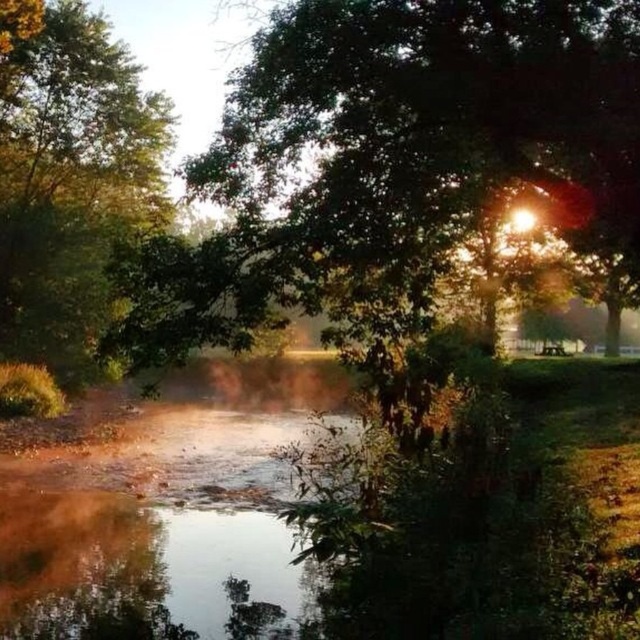
Is green leafy tree at center to the right of green leafy tree at left from the viewer's perspective?

Indeed, green leafy tree at center is positioned on the right side of green leafy tree at left.

This screenshot has height=640, width=640. Find the location of `green leafy tree at center`. green leafy tree at center is located at coordinates (396, 163).